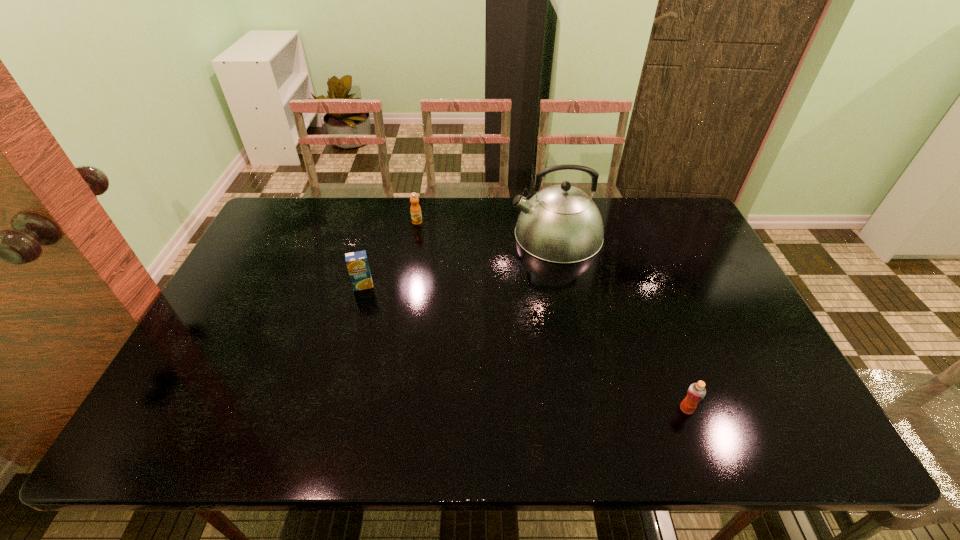
Where is `the tallest object`? The width and height of the screenshot is (960, 540). the tallest object is located at coordinates (561, 224).

Where is `the third object from left to right`? The height and width of the screenshot is (540, 960). the third object from left to right is located at coordinates (561, 224).

Find the location of a particular element. This screenshot has width=960, height=540. the second nearest object is located at coordinates tap(357, 263).

The height and width of the screenshot is (540, 960). In order to click on the second farthest orange juice in this screenshot , I will do `click(357, 263)`.

The width and height of the screenshot is (960, 540). In order to click on the farthest orange juice in this screenshot , I will do `click(416, 216)`.

What are the coordinates of `the second orange juice from right to left` in the screenshot? It's located at (416, 216).

Where is `the rightmost orange juice`? the rightmost orange juice is located at coordinates (696, 392).

At what (x,y) coordinates should I click in order to perform the action: click on the rightmost object. Please return your answer as a coordinate pair (x, y). Image resolution: width=960 pixels, height=540 pixels. Looking at the image, I should click on (696, 392).

The width and height of the screenshot is (960, 540). I want to click on vacant area located 0.310m from the spout of the kettle, so click(417, 235).

Find the location of `free space located 0.250m from the spout of the kettle`. free space located 0.250m from the spout of the kettle is located at coordinates (435, 235).